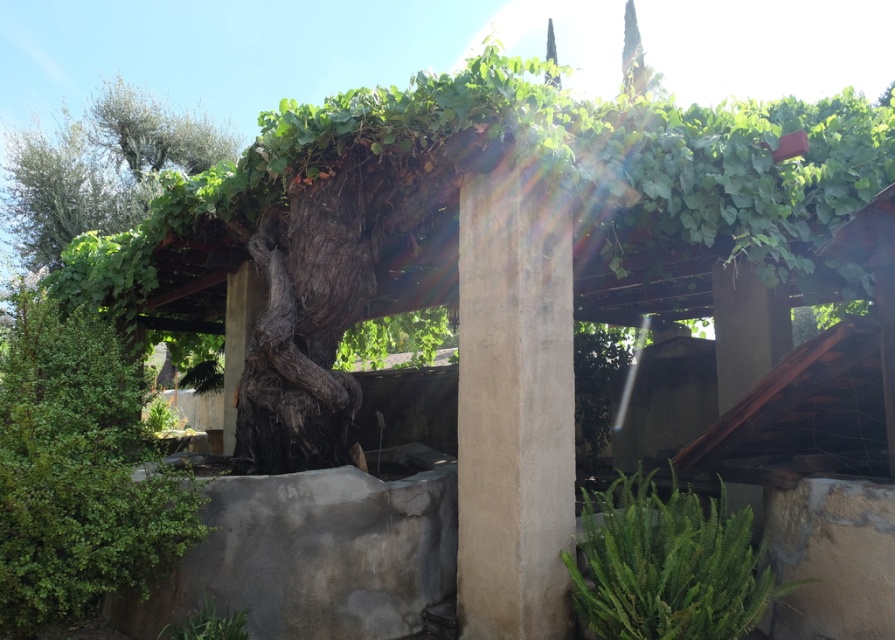
Between smooth concrete pillar at center and green leafy plant at lower right, which one appears on the left side from the viewer's perspective?

From the viewer's perspective, smooth concrete pillar at center appears more on the left side.

Is smooth concrete pillar at center positioned before green leafy plant at lower right?

That is False.

Where is `smooth concrete pillar at center`? smooth concrete pillar at center is located at coordinates (514, 403).

Locate an element on the screen. smooth concrete pillar at center is located at coordinates (514, 403).

Is point (504, 634) positioned in front of point (84, 180)?

Yes.

Can you confirm if smooth concrete pillar at center is taller than green leafy tree at upper left?

No.

Which is behind, point (459, 244) or point (94, 216)?

Point (94, 216)

At what (x,y) coordinates should I click in order to perform the action: click on smooth concrete pillar at center. Please return your answer as a coordinate pair (x, y). This screenshot has width=895, height=640. Looking at the image, I should click on (514, 403).

Between point (685, 609) and point (39, 147), which one is positioned in front?

Point (685, 609) is more forward.

Is green leafy plant at lower right taller than green leafy tree at upper left?

Incorrect, green leafy plant at lower right's height is not larger of green leafy tree at upper left's.

Does point (586, 563) come behind point (69, 150)?

No, it is not.

I want to click on green leafy plant at lower right, so click(x=666, y=563).